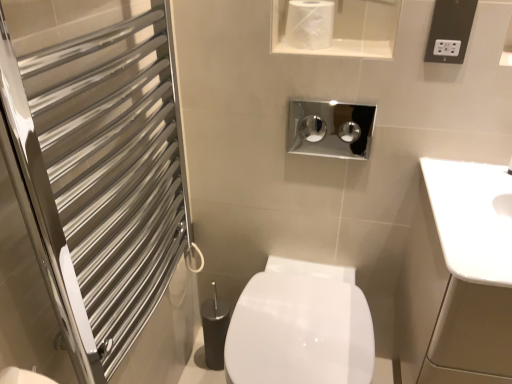
Question: Is black plastic electrical outlet at upper right surrounding silver metallic towel rack at left?

Choices:
 (A) no
 (B) yes

Answer: (A)

Question: Considering the relative sizes of black plastic electrical outlet at upper right and silver metallic towel rack at left in the image provided, is black plastic electrical outlet at upper right shorter than silver metallic towel rack at left?

Choices:
 (A) yes
 (B) no

Answer: (A)

Question: From the image's perspective, would you say black plastic electrical outlet at upper right is positioned over silver metallic towel rack at left?

Choices:
 (A) yes
 (B) no

Answer: (A)

Question: From a real-world perspective, does black plastic electrical outlet at upper right sit lower than silver metallic towel rack at left?

Choices:
 (A) yes
 (B) no

Answer: (B)

Question: Is black plastic electrical outlet at upper right to the left of silver metallic towel rack at left from the viewer's perspective?

Choices:
 (A) yes
 (B) no

Answer: (B)

Question: Relative to white glossy toilet paper at upper center, is silver metallic towel rack at left in front or behind?

Choices:
 (A) front
 (B) behind

Answer: (A)

Question: From a real-world perspective, is silver metallic towel rack at left above or below white glossy toilet paper at upper center?

Choices:
 (A) above
 (B) below

Answer: (B)

Question: In terms of width, does silver metallic towel rack at left look wider or thinner when compared to white glossy toilet paper at upper center?

Choices:
 (A) thin
 (B) wide

Answer: (A)

Question: Considering the positions of silver metallic towel rack at left and white glossy toilet paper at upper center in the image, is silver metallic towel rack at left taller or shorter than white glossy toilet paper at upper center?

Choices:
 (A) short
 (B) tall

Answer: (B)

Question: In terms of width, does white glossy toilet paper at upper center look wider or thinner when compared to silver metallic towel rack at left?

Choices:
 (A) wide
 (B) thin

Answer: (A)

Question: Considering their positions, is white glossy toilet paper at upper center located in front of or behind silver metallic towel rack at left?

Choices:
 (A) front
 (B) behind

Answer: (B)

Question: Which is correct: white glossy toilet paper at upper center is inside silver metallic towel rack at left, or outside of it?

Choices:
 (A) outside
 (B) inside

Answer: (A)

Question: Considering the positions of white glossy toilet paper at upper center and silver metallic towel rack at left in the image, is white glossy toilet paper at upper center taller or shorter than silver metallic towel rack at left?

Choices:
 (A) tall
 (B) short

Answer: (B)

Question: Considering the positions of white glossy toilet paper at upper center and white glossy bidet at center in the image, is white glossy toilet paper at upper center taller or shorter than white glossy bidet at center?

Choices:
 (A) tall
 (B) short

Answer: (B)

Question: Which is correct: white glossy toilet paper at upper center is inside white glossy bidet at center, or outside of it?

Choices:
 (A) inside
 (B) outside

Answer: (B)